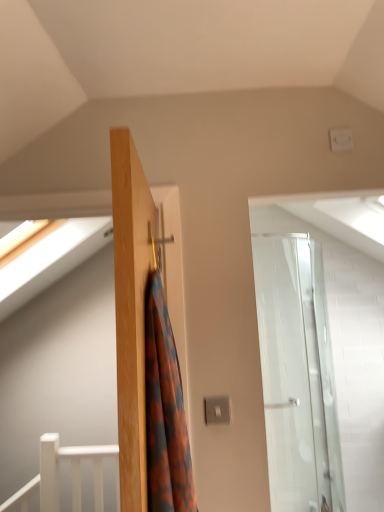
Question: From a real-world perspective, relative to orange patterned fabric at center, is white matte rail at lower left vertically above or below?

Choices:
 (A) below
 (B) above

Answer: (A)

Question: From the image's perspective, is white matte rail at lower left above or below orange patterned fabric at center?

Choices:
 (A) above
 (B) below

Answer: (B)

Question: In terms of width, does white matte rail at lower left look wider or thinner when compared to orange patterned fabric at center?

Choices:
 (A) thin
 (B) wide

Answer: (A)

Question: Considering the positions of orange patterned fabric at center and white matte rail at lower left in the image, is orange patterned fabric at center wider or thinner than white matte rail at lower left?

Choices:
 (A) thin
 (B) wide

Answer: (B)

Question: Is point tap(145, 401) positioned closer to the camera than point tap(46, 461)?

Choices:
 (A) closer
 (B) farther

Answer: (A)

Question: From a real-world perspective, is orange patterned fabric at center physically located above or below white matte rail at lower left?

Choices:
 (A) below
 (B) above

Answer: (B)

Question: Considering their positions, is orange patterned fabric at center located in front of or behind white matte rail at lower left?

Choices:
 (A) behind
 (B) front

Answer: (B)